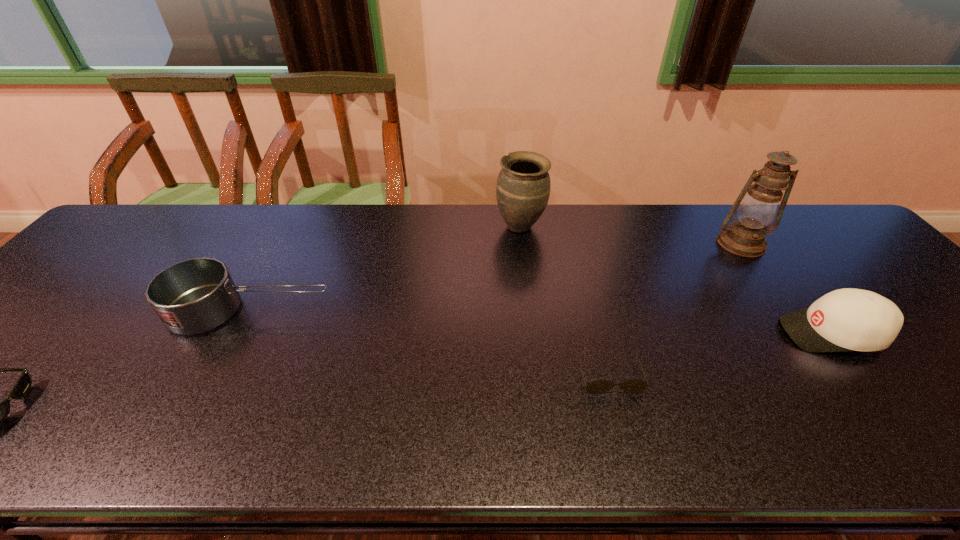
I want to click on the tallest object, so click(x=745, y=237).

Identify the location of the third object from left to right. This screenshot has height=540, width=960. (523, 185).

The width and height of the screenshot is (960, 540). I want to click on urn, so click(523, 185).

Where is `baseball cap`? This screenshot has width=960, height=540. baseball cap is located at coordinates (848, 319).

Find the location of a particular element. saucepan is located at coordinates (193, 296).

Locate an element on the screen. the right sunglasses is located at coordinates coord(633,386).

Where is `vacant area located 0.090m on the right of the oil lamp`? vacant area located 0.090m on the right of the oil lamp is located at coordinates (799, 244).

This screenshot has height=540, width=960. I want to click on free space located 0.100m on the left of the urn, so click(463, 226).

This screenshot has height=540, width=960. Find the location of `vacant space located 0.240m on the front-facing side of the baseball cap`. vacant space located 0.240m on the front-facing side of the baseball cap is located at coordinates (681, 333).

Image resolution: width=960 pixels, height=540 pixels. In order to click on vacant space located 0.080m on the front-facing side of the baseball cap in this screenshot , I will do `click(749, 333)`.